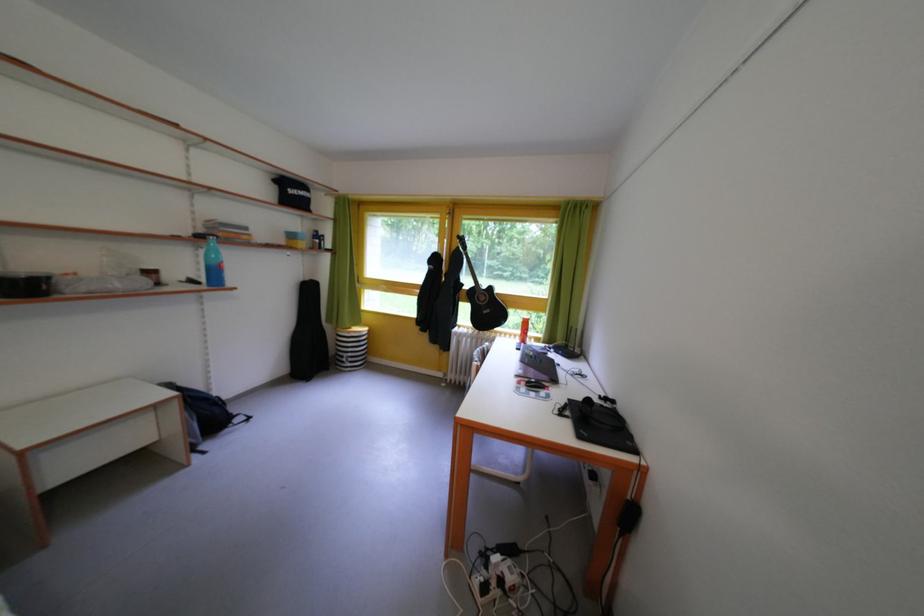
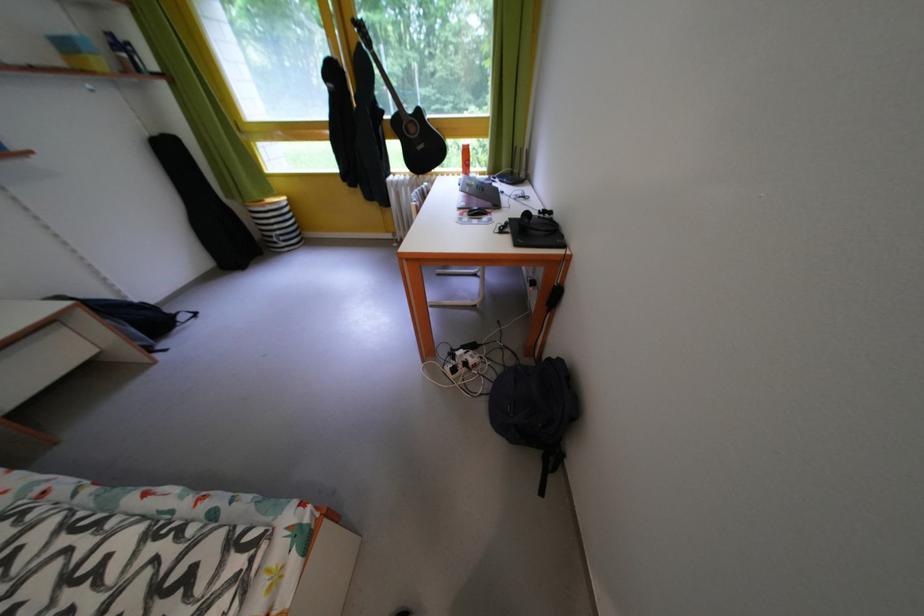
The point at (511,588) is marked in the first image. Where is the corresponding point in the second image?

(476, 370)